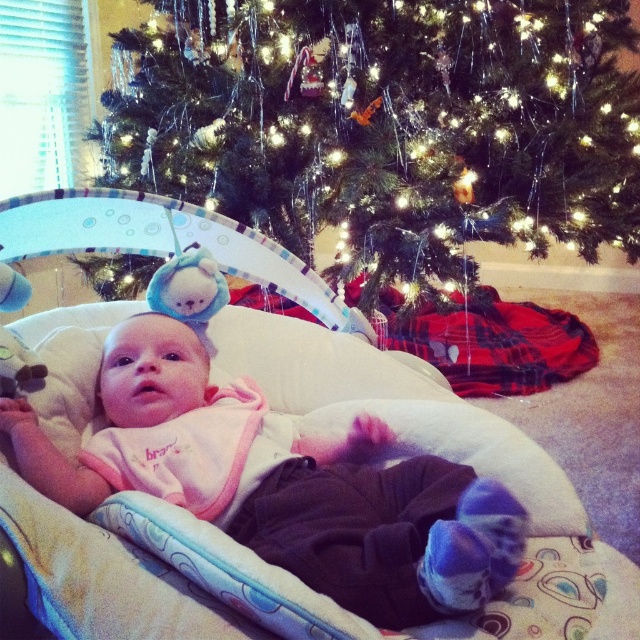
Is green matte christmas tree at center taller than pink fleece baby at center?

Indeed, green matte christmas tree at center has a greater height compared to pink fleece baby at center.

Is green matte christmas tree at center bigger than pink fleece baby at center?

Correct, green matte christmas tree at center is larger in size than pink fleece baby at center.

Where is `green matte christmas tree at center`? The width and height of the screenshot is (640, 640). green matte christmas tree at center is located at coordinates (388, 124).

The image size is (640, 640). I want to click on green matte christmas tree at center, so click(x=388, y=124).